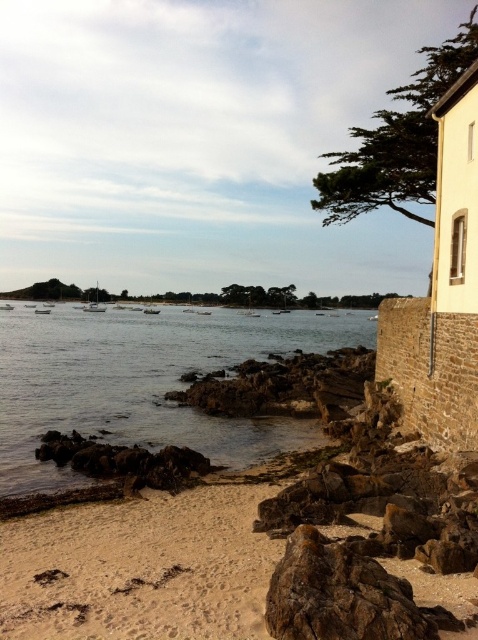
Question: Among these points, which one is nearest to the camera?

Choices:
 (A) (234, 378)
 (B) (33, 388)

Answer: (B)

Question: Is clear water at lower left to the left of rusty metallic rocks at center from the viewer's perspective?

Choices:
 (A) yes
 (B) no

Answer: (A)

Question: Does clear water at lower left appear over rusty metallic rocks at center?

Choices:
 (A) yes
 (B) no

Answer: (A)

Question: Among these objects, which one is farthest from the camera?

Choices:
 (A) rusty metallic rocks at center
 (B) clear water at lower left

Answer: (A)

Question: Is clear water at lower left positioned at the back of rusty metallic rocks at center?

Choices:
 (A) yes
 (B) no

Answer: (B)